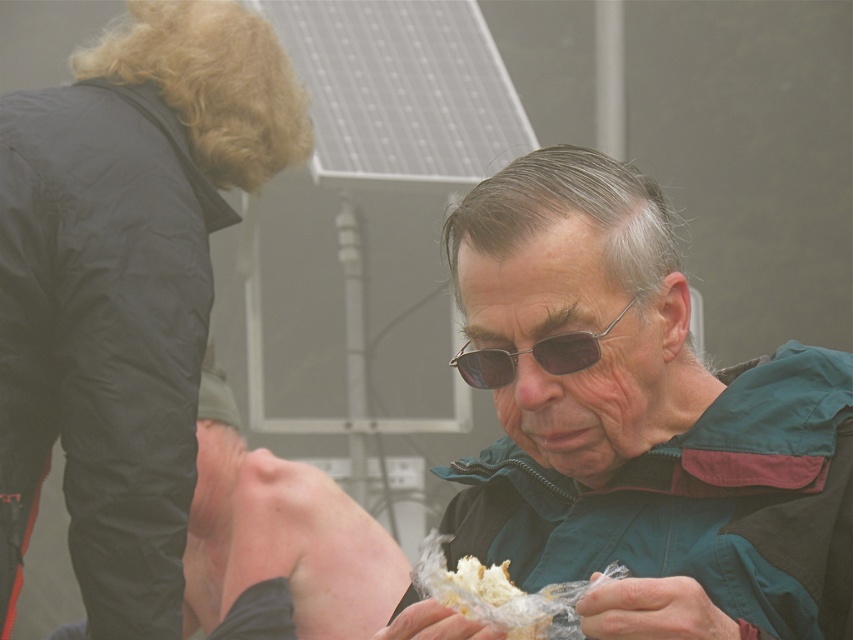
Question: Is matte black jacket at lower right wider than sunglasses at center?

Choices:
 (A) yes
 (B) no

Answer: (A)

Question: Does sunglasses at center have a lesser width compared to white crumbly bread at center?

Choices:
 (A) no
 (B) yes

Answer: (A)

Question: Estimate the real-world distances between objects in this image. Which object is closer to the matte black jacket at lower right?

Choices:
 (A) green fabric jacket at center
 (B) sunglasses at center
 (C) white crumbly bread at center

Answer: (A)

Question: Among these points, which one is nearest to the camera?

Choices:
 (A) (485, 600)
 (B) (158, 577)
 (C) (194, 513)

Answer: (A)

Question: Among these points, which one is nearest to the camera?

Choices:
 (A) (271, 476)
 (B) (543, 634)
 (C) (96, 522)
 (D) (550, 566)

Answer: (B)

Question: Is matte black jacket at lower right thinner than sunglasses at center?

Choices:
 (A) yes
 (B) no

Answer: (B)